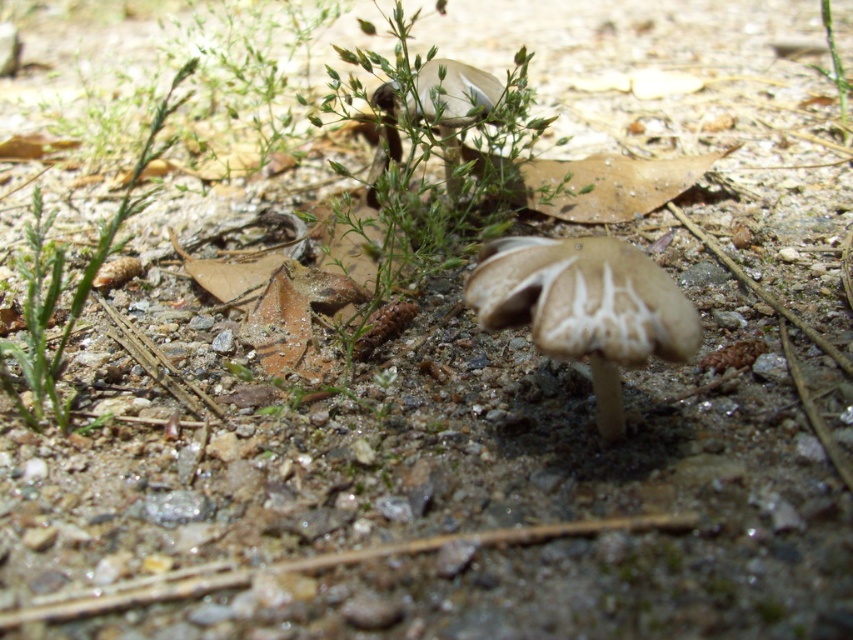
Is brown matte mushroom at center taller than green leafy plant at left?

No.

Which is more to the left, brown matte mushroom at center or green leafy plant at left?

green leafy plant at left

The image size is (853, 640). What are the coordinates of `brown matte mushroom at center` in the screenshot? It's located at (585, 307).